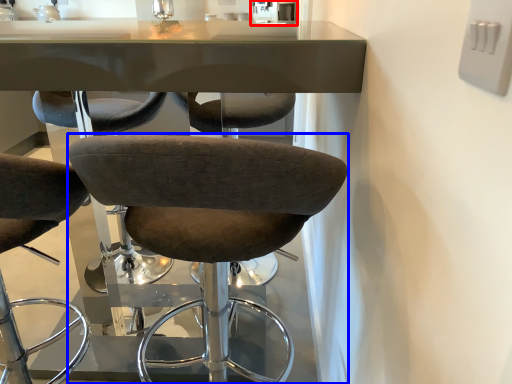
Question: Which of the following is the farthest to the observer, sink (highlighted by a red box) or chair (highlighted by a blue box)?

Choices:
 (A) sink
 (B) chair

Answer: (A)